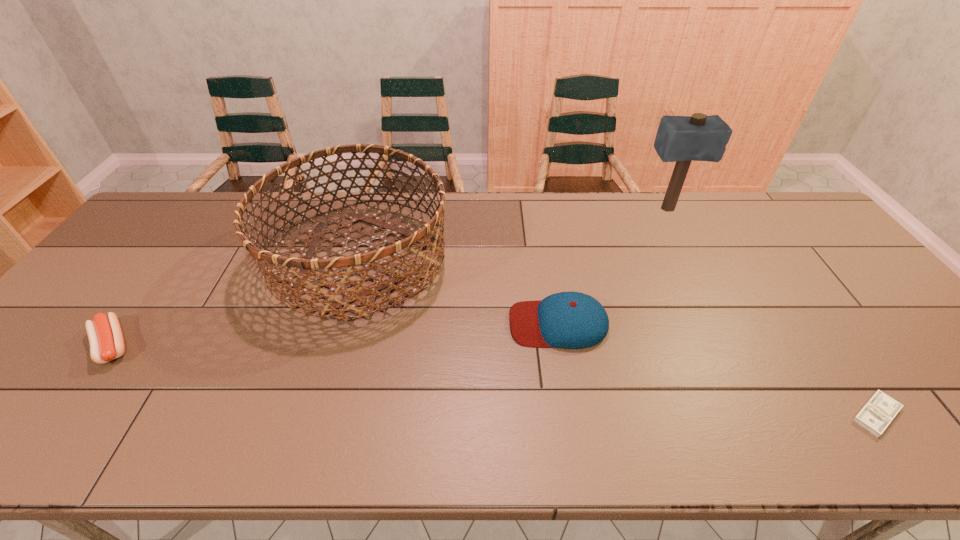
Find the location of a particular element. The height and width of the screenshot is (540, 960). the fourth object from left to right is located at coordinates (681, 139).

The width and height of the screenshot is (960, 540). In order to click on the tallest object in this screenshot , I will do `click(681, 139)`.

The image size is (960, 540). Identify the location of basket. (311, 262).

Find the location of a particular element. The width and height of the screenshot is (960, 540). the fourth shortest object is located at coordinates (311, 262).

The width and height of the screenshot is (960, 540). I want to click on the third tallest object, so click(572, 320).

Identify the location of the third object from right to left. (572, 320).

The width and height of the screenshot is (960, 540). In order to click on the leftmost object in this screenshot , I will do `click(106, 341)`.

At what (x,y) coordinates should I click in order to perform the action: click on the second shortest object. Please return your answer as a coordinate pair (x, y). This screenshot has width=960, height=540. Looking at the image, I should click on (106, 341).

I want to click on the nearest object, so click(875, 416).

Identify the location of money. (875, 416).